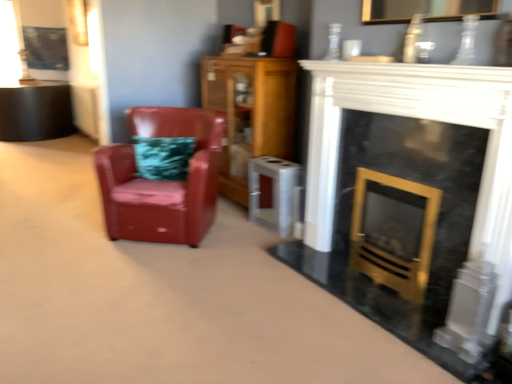
Where is `free spot to the right of glossy leather armchair at left`? This screenshot has width=512, height=384. free spot to the right of glossy leather armchair at left is located at coordinates (252, 243).